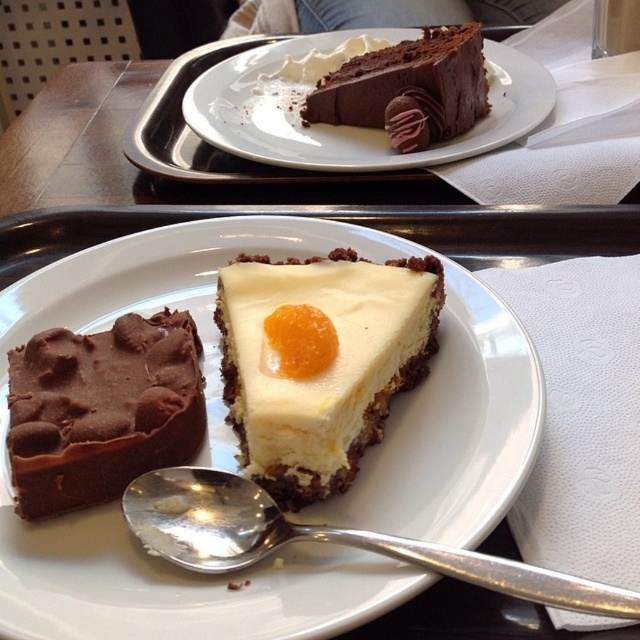
Which is behind, point (294, 412) or point (269, 64)?

The point (269, 64) is more distant.

Who is lower down, white creamy cake at center or chocolate cake at upper center?

white creamy cake at center is below.

Locate an element on the screen. The image size is (640, 640). white creamy cake at center is located at coordinates (321, 362).

You are a GUI agent. You are given a task and a screenshot of the screen. Output one action in this format:
    pyautogui.click(x=<x>, y=<y>)
    Task: Click on the white creamy cake at center
    
    Given the screenshot: What is the action you would take?
    pyautogui.click(x=321, y=362)

Consider the image. Can you confirm if chocolate cake at upper center is shorter than smooth chocolate cake at upper center?

No.

The width and height of the screenshot is (640, 640). I want to click on chocolate cake at upper center, so click(x=346, y=125).

Is white glossy plate at center positioned in front of smooth chocolate cake at upper center?

Yes, white glossy plate at center is in front of smooth chocolate cake at upper center.

Who is positioned more to the right, white glossy plate at center or smooth chocolate cake at upper center?

smooth chocolate cake at upper center

What do you see at coordinates (177, 584) in the screenshot? I see `white glossy plate at center` at bounding box center [177, 584].

At what (x,y) coordinates should I click in order to perform the action: click on white glossy plate at center. Please return your answer as a coordinate pair (x, y). Image resolution: width=640 pixels, height=640 pixels. Looking at the image, I should click on (177, 584).